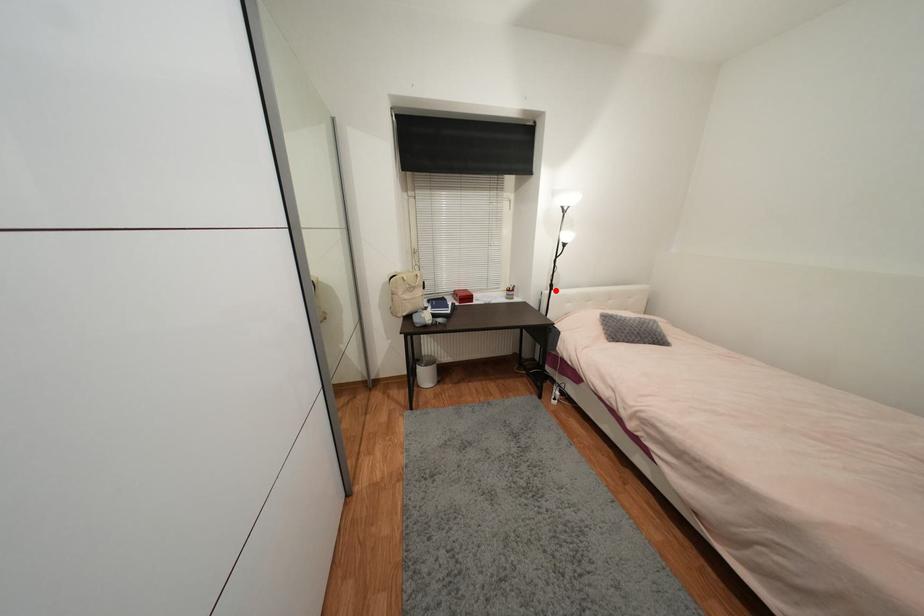
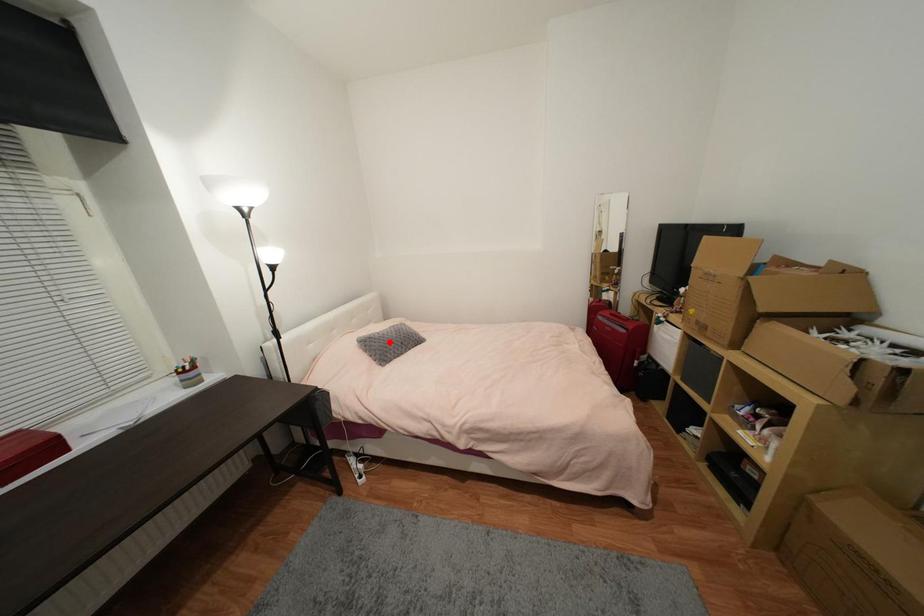
I am providing you with two images of the same scene from different viewpoints. A red point is marked on the first image and another point is marked on the second image. Is the red point in image1 aligned with the point shown in image2?

No